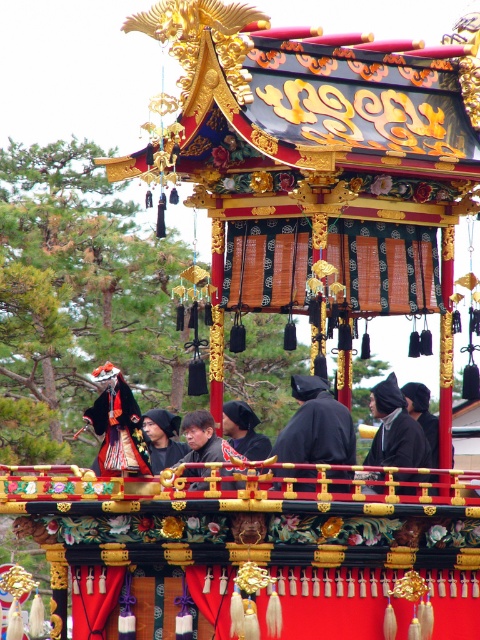
You are standing in front of the ornate float and notice two points marked on its surface. The first point is at coordinate point (334, 422) and the second is at point (420, 449). Which of these points is closer to your viewpoint?

Point (334, 422) is closer to the camera than point (420, 449).

You are an artist creating a miniature model of the float. You have to decide the scale for the black matte clothing at center and the matte black mask at center. Which object should you make larger in your model to stay true to the original float?

The black matte clothing at center should be made larger in the model since it has a larger size compared to the matte black mask at center in the original float.

You are an artist trying to paint the float from the image. You want to focus on the black matte robe at center. Where exactly should you look to find it on the float?

The black matte robe at center is located at point coordinates of (317, 433).